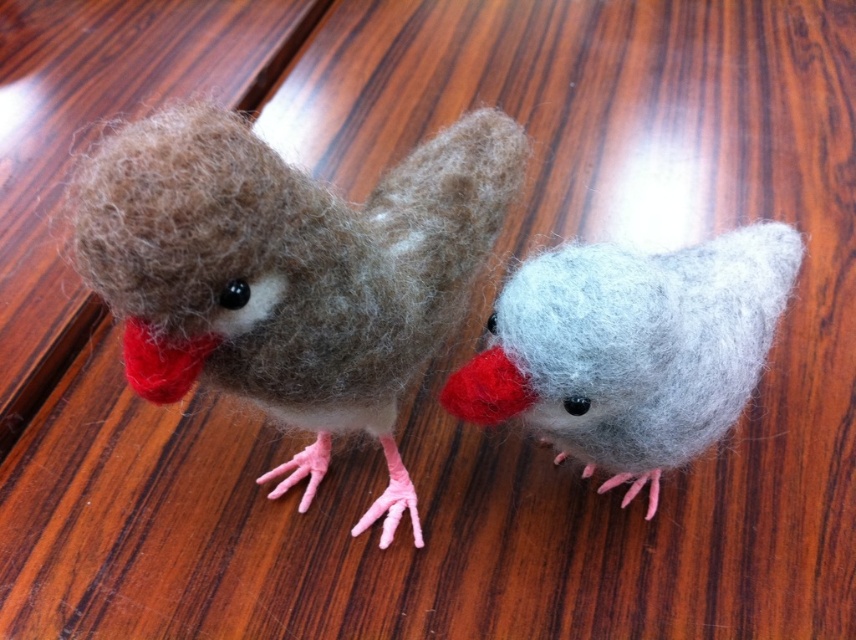
Question: Is light gray felt bird at center positioned in front of matte red beak at center?

Choices:
 (A) yes
 (B) no

Answer: (A)

Question: Is light gray felt bird at center wider than fuzzy red beak at left?

Choices:
 (A) no
 (B) yes

Answer: (B)

Question: Which point appears closest to the camera in this image?

Choices:
 (A) (403, 484)
 (B) (152, 339)

Answer: (B)

Question: Considering the real-world distances, which object is closest to the fuzzy red beak at left?

Choices:
 (A) light gray felt bird at center
 (B) matte red beak at center
 (C) fuzzy brown bird at left

Answer: (C)

Question: Is light gray felt bird at center thinner than fuzzy red beak at left?

Choices:
 (A) yes
 (B) no

Answer: (B)

Question: Which point is farther to the camera?

Choices:
 (A) (456, 374)
 (B) (421, 211)

Answer: (B)